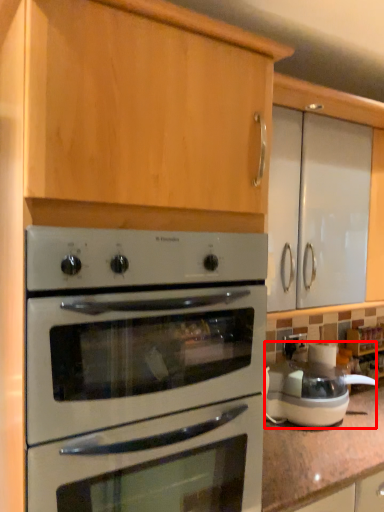
Question: Considering the relative positions of appliance (annotated by the red box) and oven in the image provided, where is appliance (annotated by the red box) located with respect to the staircase?

Choices:
 (A) right
 (B) left

Answer: (A)